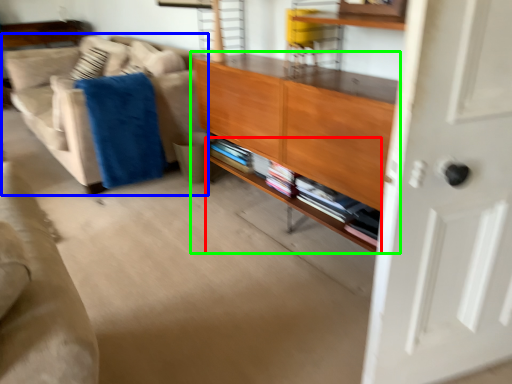
Question: Estimate the real-world distances between objects in this image. Which object is farther from shelf (highlighted by a red box), studio couch (highlighted by a blue box) or cabinetry (highlighted by a green box)?

Choices:
 (A) studio couch
 (B) cabinetry

Answer: (A)